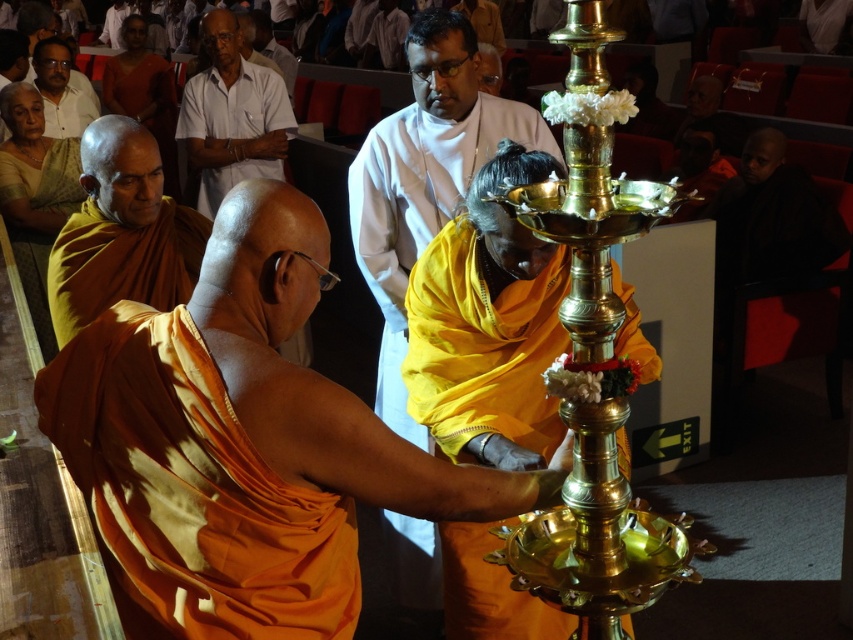
You are an observer in the temple scene. You notice the orange clothed monk at left and the matte white shirt at upper left. Which of these two figures takes up more visual space in the image?

The matte white shirt at upper left takes up more visual space than the orange clothed monk at left because the orange clothed monk at left occupies less space than matte white shirt at upper left.

You are standing at the entrance of the temple and see two points in the scene. The first point is at coordinates point (440, 604) and the second is at point (236, 109). Which point is closer to you?

Point (440, 604) is in front of point (236, 109), so it is closer to you.